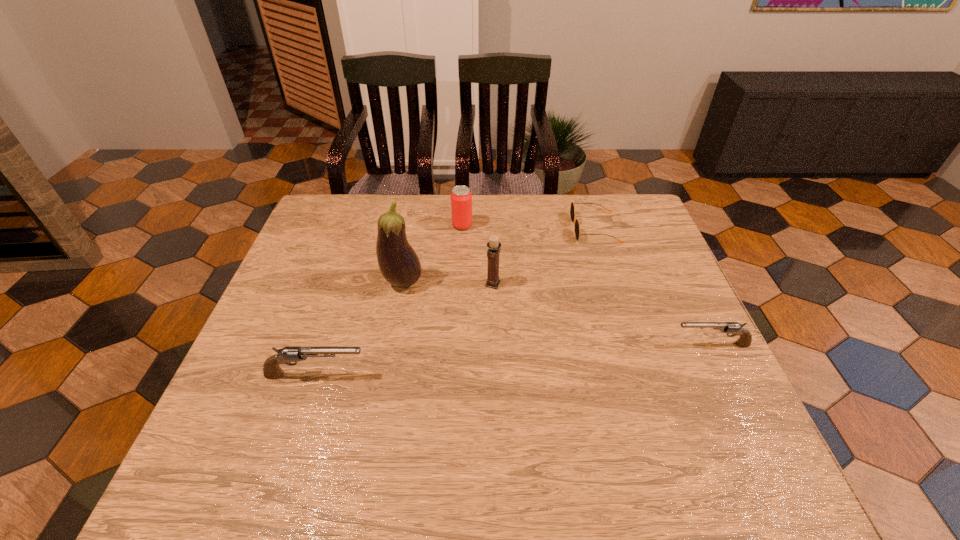
Identify the location of vacant point located 0.330m on the left of the fourth object from left to right. The width and height of the screenshot is (960, 540). (362, 284).

Where is `sunglasses present at the far edge`? This screenshot has width=960, height=540. sunglasses present at the far edge is located at coordinates (572, 209).

Where is `beer can at the far edge`? The height and width of the screenshot is (540, 960). beer can at the far edge is located at coordinates (461, 198).

Locate an element on the screen. Image resolution: width=960 pixels, height=540 pixels. object situated at the left edge is located at coordinates (271, 369).

Identify the location of gun located in the right edge section of the desktop. The image size is (960, 540). (745, 339).

Where is `sunglasses that is at the right edge`? The width and height of the screenshot is (960, 540). sunglasses that is at the right edge is located at coordinates (572, 209).

This screenshot has width=960, height=540. In order to click on object located at the far right corner in this screenshot , I will do `click(572, 209)`.

Locate an element on the screen. This screenshot has width=960, height=540. free space at the far edge of the desktop is located at coordinates (376, 217).

Where is `free space at the near edge of the desktop`? The image size is (960, 540). free space at the near edge of the desktop is located at coordinates (436, 395).

The width and height of the screenshot is (960, 540). In order to click on vacant space at the left edge of the desktop in this screenshot , I will do click(320, 247).